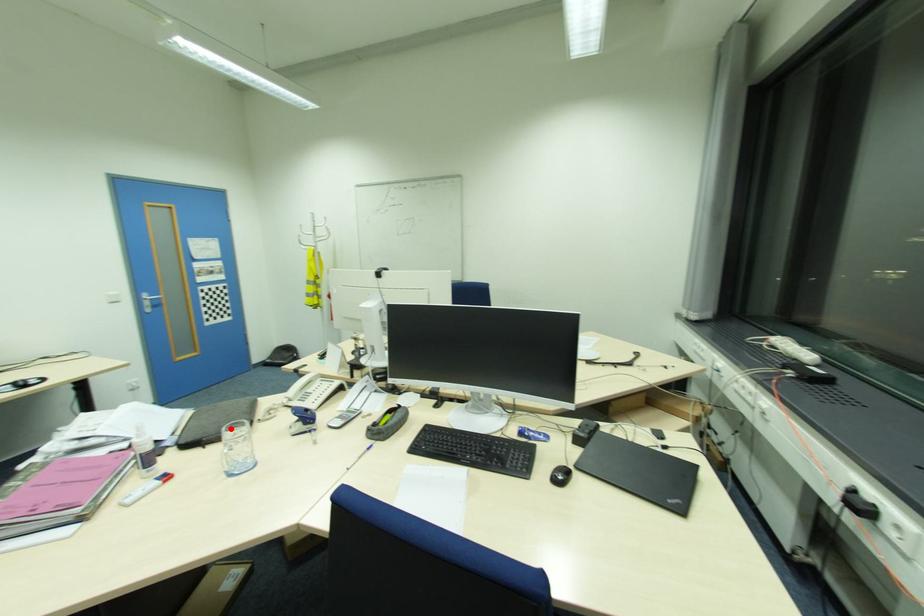
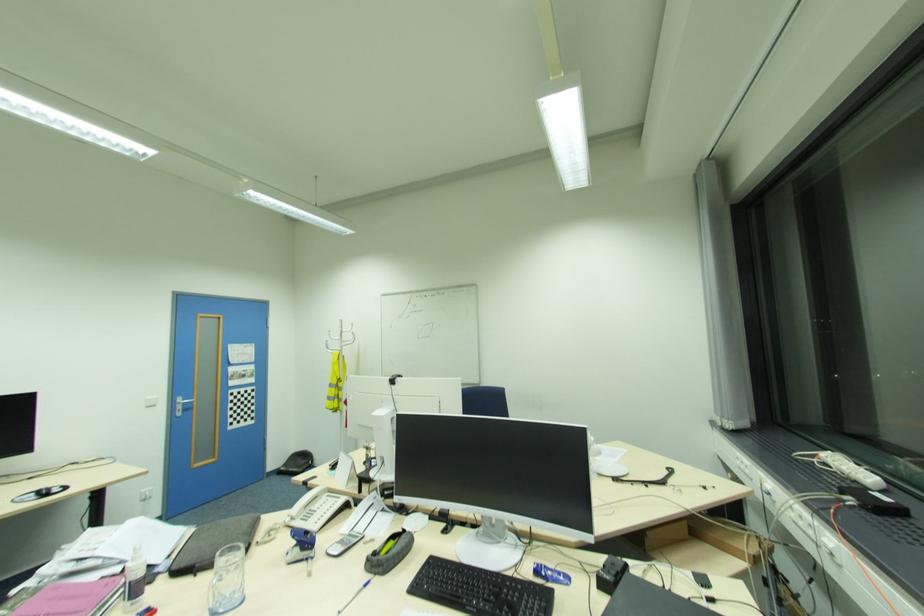
Question: I am providing you with two images of the same scene from different viewpoints. Given a red point in image1, look at the same physical point in image2. Is it:

Choices:
 (A) Closer to the viewpoint
 (B) Farther from the viewpoint

Answer: (A)